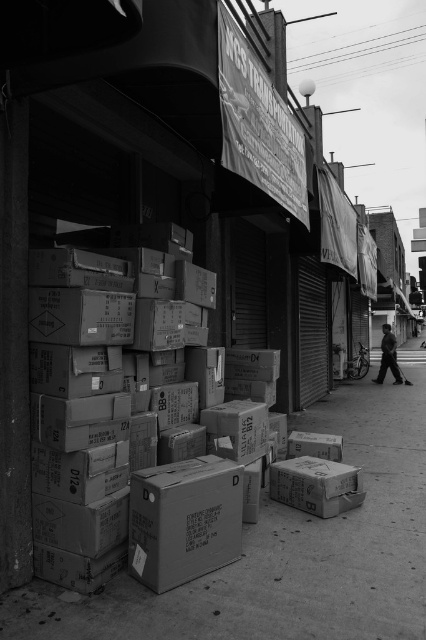
You are standing on the sidewalk in front of the closed storefronts and want to walk to the point marked as point [374,556]. Which direction should you move relative to point [386,339]?

Since point [374,556] is closer to you than point [386,339], you should move towards point [374,556], which is in front of point [386,339] from your perspective.

You are a delivery person who needs to place a new package on the ground. You see the matte cardboard boxes at lower center and the dark gray suit at right. Which object is located above the other?

The dark gray suit at right is above the matte cardboard boxes at lower center because the matte cardboard boxes at lower center is positioned under dark gray suit at right.